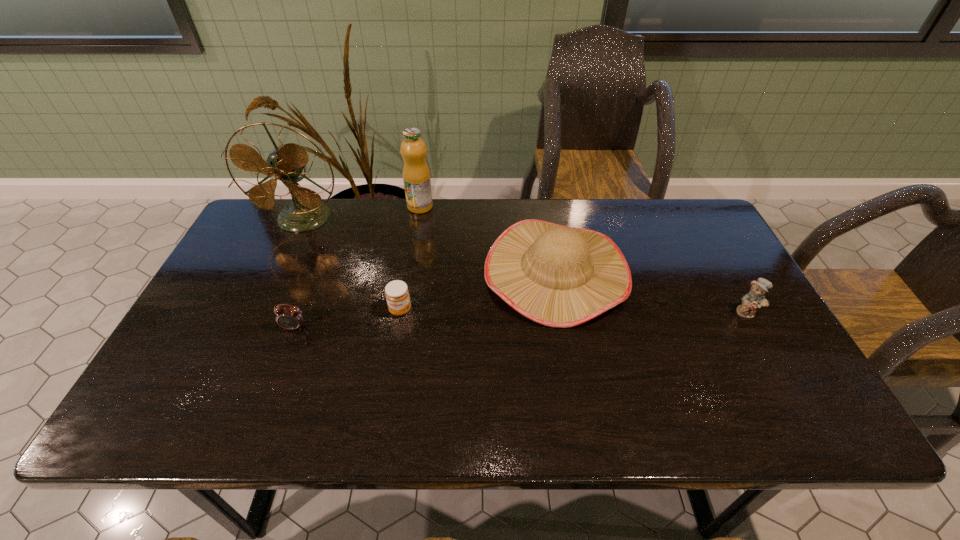
Where is `vacant region located 0.210m on the right of the fourth shortest object`? The height and width of the screenshot is (540, 960). vacant region located 0.210m on the right of the fourth shortest object is located at coordinates (704, 272).

Where is `vacant space located 0.170m on the front-facing side of the fourth tallest object`? This screenshot has height=540, width=960. vacant space located 0.170m on the front-facing side of the fourth tallest object is located at coordinates (783, 377).

You are a GUI agent. You are given a task and a screenshot of the screen. Output one action in this format:
    pyautogui.click(x=<x>, y=<y>)
    Task: Click on the vacant position located on the face of the alarm clock
    This screenshot has width=960, height=540.
    Given the screenshot: What is the action you would take?
    pyautogui.click(x=271, y=389)

The height and width of the screenshot is (540, 960). Identify the location of vacant space located on the front label of the jam. (396, 335).

Locate an element on the screen. The image size is (960, 540). fan located in the far edge section of the desktop is located at coordinates (286, 162).

I want to click on fruit juice located at the far edge, so click(x=416, y=175).

Locate an element on the screen. The height and width of the screenshot is (540, 960). sunhat present at the far edge is located at coordinates (559, 276).

At what (x,y) coordinates should I click in order to perform the action: click on object situated at the left edge. Please return your answer as a coordinate pair (x, y). The height and width of the screenshot is (540, 960). Looking at the image, I should click on (286, 162).

I want to click on object situated at the right edge, so click(755, 298).

Locate an element on the screen. This screenshot has height=540, width=960. object present at the far left corner is located at coordinates (286, 162).